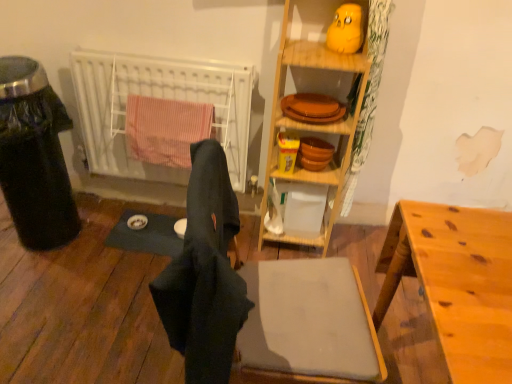
Identify the location of free area below white matte radiator at left (from a real-world perspective). (147, 203).